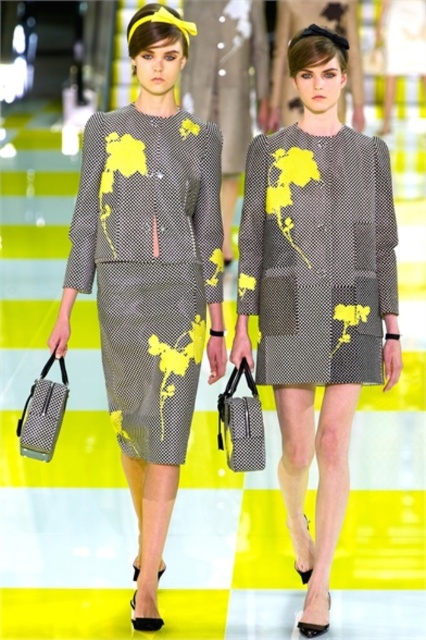
You are a fashion designer observing the runway show. You need to determine which dress is narrower between the matte gray dress with yellow floral print at center and the textured gray dress at center. Which one is narrower?

The matte gray dress with yellow floral print at center has a lesser width compared to the textured gray dress at center, so it is narrower.